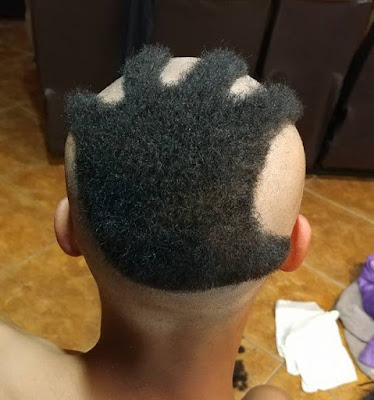
Identify the location of floor. (335, 236), (39, 266).